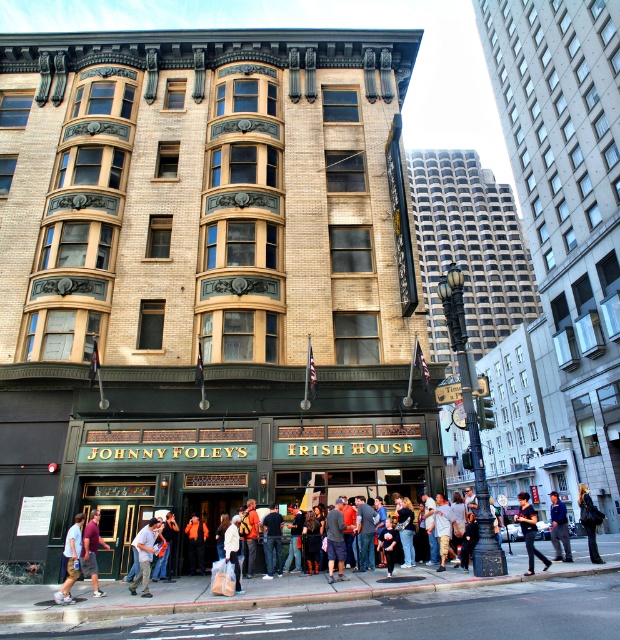
Question: Which object is farther from the camera taking this photo?

Choices:
 (A) black leather jacket at center
 (B) dark blue jeans at center
 (C) light blue denim shorts at lower left
 (D) maroon shirt at center

Answer: (B)

Question: Is light blue denim shorts at lower left above dark gray pants at center?

Choices:
 (A) yes
 (B) no

Answer: (A)

Question: Can you confirm if maroon shirt at center is positioned to the right of dark gray pants at center?

Choices:
 (A) no
 (B) yes

Answer: (A)

Question: Which point appears closest to the camera in this image?

Choices:
 (A) (551, 540)
 (B) (99, 540)

Answer: (B)

Question: Can you confirm if black leather jacket at center is positioned to the right of dark blue jeans at center?

Choices:
 (A) yes
 (B) no

Answer: (B)

Question: Among these points, which one is nearest to the camera?

Choices:
 (A) (577, 492)
 (B) (81, 572)
 (C) (510, 577)

Answer: (C)